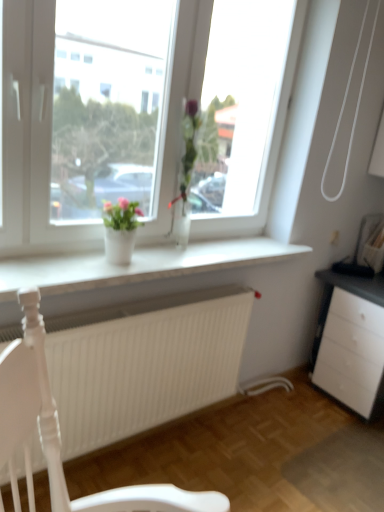
Question: Can you confirm if clear glass vase at center, which is the first houseplant from right to left, is wider than white matte radiator at lower center?

Choices:
 (A) no
 (B) yes

Answer: (A)

Question: Would you say white matte radiator at lower center is part of clear glass vase at center, which is the first houseplant from right to left,'s contents?

Choices:
 (A) yes
 (B) no

Answer: (B)

Question: Considering the relative sizes of clear glass vase at center, which is the 2th houseplant from left to right, and white matte radiator at lower center in the image provided, is clear glass vase at center, which is the 2th houseplant from left to right, bigger than white matte radiator at lower center?

Choices:
 (A) no
 (B) yes

Answer: (A)

Question: Is clear glass vase at center, which is the first houseplant from right to left, further to camera compared to white matte radiator at lower center?

Choices:
 (A) yes
 (B) no

Answer: (A)

Question: From a real-world perspective, is clear glass vase at center, which is the 2th houseplant from left to right, positioned over white matte radiator at lower center based on gravity?

Choices:
 (A) no
 (B) yes

Answer: (B)

Question: Is clear glass vase at center, which is the 2th houseplant from left to right, not near white matte radiator at lower center?

Choices:
 (A) no
 (B) yes

Answer: (A)

Question: Does clear glass vase at center, which is the 2th houseplant from left to right, have a larger size compared to white glossy vase at center, the 2th houseplant from the right?

Choices:
 (A) no
 (B) yes

Answer: (B)

Question: Is clear glass vase at center, which is the 2th houseplant from left to right, oriented towards white glossy vase at center, the 1th houseplant from the left?

Choices:
 (A) no
 (B) yes

Answer: (A)

Question: Is clear glass vase at center, which is the 2th houseplant from left to right, shorter than white glossy vase at center, the 2th houseplant from the right?

Choices:
 (A) no
 (B) yes

Answer: (A)

Question: Is clear glass vase at center, which is the 2th houseplant from left to right, positioned beyond the bounds of white glossy vase at center, the 2th houseplant from the right?

Choices:
 (A) yes
 (B) no

Answer: (A)

Question: Can you confirm if clear glass vase at center, which is the first houseplant from right to left, is thinner than white glossy vase at center, the 1th houseplant from the left?

Choices:
 (A) yes
 (B) no

Answer: (A)

Question: Is clear glass vase at center, which is the 2th houseplant from left to right, wider than white glossy vase at center, the 2th houseplant from the right?

Choices:
 (A) yes
 (B) no

Answer: (B)

Question: Are white glass vase at center and clear glass vase at center, which is the 2th houseplant from left to right, making contact?

Choices:
 (A) yes
 (B) no

Answer: (B)